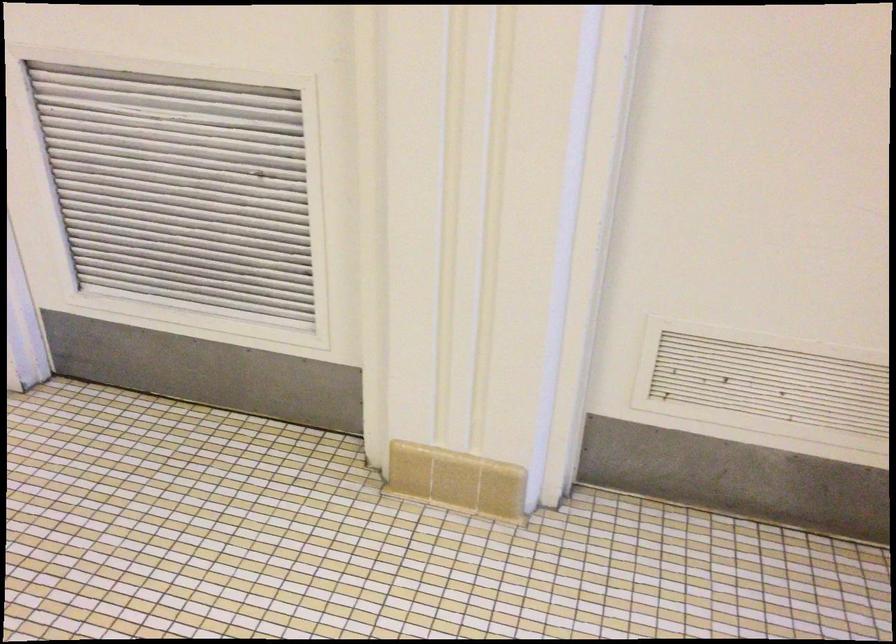
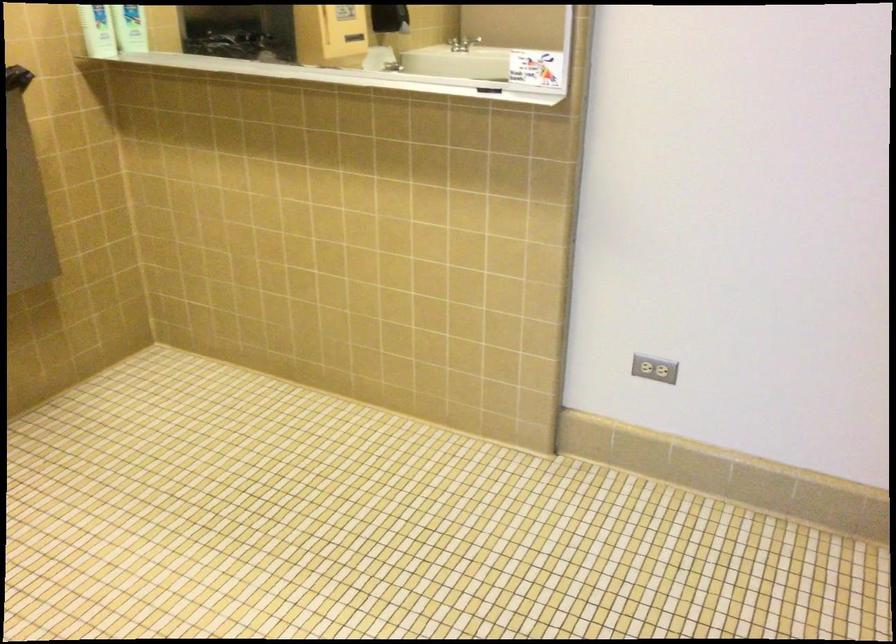
The images are taken continuously from a first-person perspective. In which direction is your viewpoint rotating?

The camera rotated toward left-down.